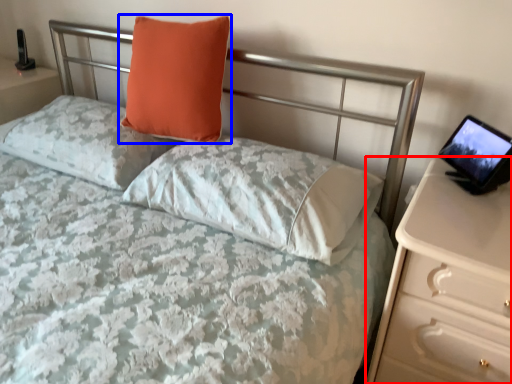
Question: Among these objects, which one is nearest to the camera, nightstand (highlighted by a red box) or pillow (highlighted by a blue box)?

Choices:
 (A) nightstand
 (B) pillow

Answer: (A)